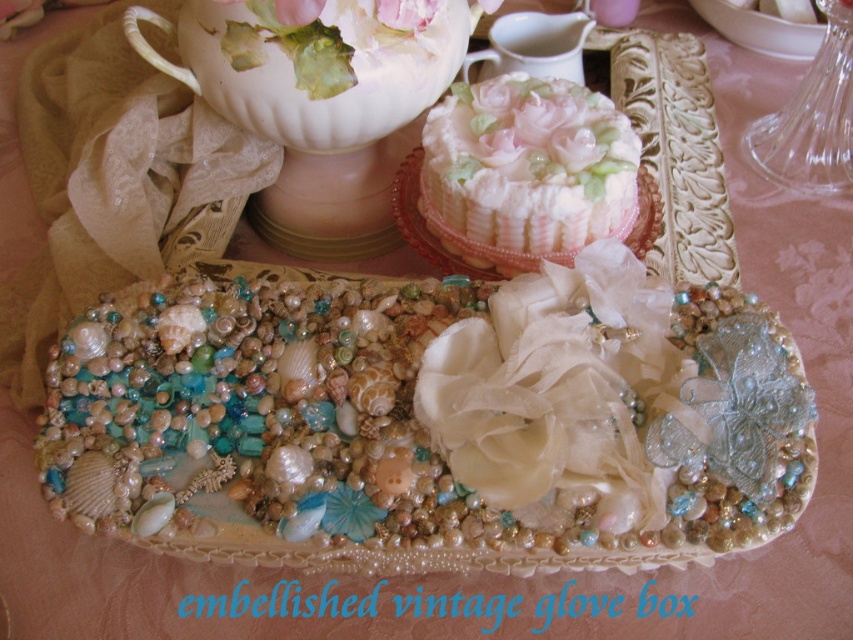
Is the position of white frosting cake at center less distant than that of pink fabric flower at center?

That is False.

Which is more to the left, white frosting cake at center or pink fabric flower at center?

pink fabric flower at center

Which is in front, point (548, 148) or point (413, 17)?

Point (413, 17) is in front.

Locate an element on the screen. This screenshot has width=853, height=640. white frosting cake at center is located at coordinates (526, 170).

Which is above, matte porcelain teacup at upper center or pink fabric flower at center?

Positioned higher is matte porcelain teacup at upper center.

Is matte porcelain teacup at upper center shorter than pink fabric flower at center?

No, matte porcelain teacup at upper center is not shorter than pink fabric flower at center.

Between point (576, 54) and point (415, 4), which one is positioned in front?

Point (415, 4) is more forward.

You are a GUI agent. You are given a task and a screenshot of the screen. Output one action in this format:
    pyautogui.click(x=<x>, y=<y>)
    Task: Click on the matte porcelain teacup at upper center
    The height and width of the screenshot is (640, 853).
    Given the screenshot: What is the action you would take?
    pyautogui.click(x=532, y=45)

Can you confirm if white frosting cake at center is positioned to the left of matte porcelain teacup at upper center?

No, white frosting cake at center is not to the left of matte porcelain teacup at upper center.

How far apart are white frosting cake at center and matte porcelain teacup at upper center?

white frosting cake at center and matte porcelain teacup at upper center are 13.50 centimeters apart.

Locate an element on the screen. white frosting cake at center is located at coordinates (526, 170).